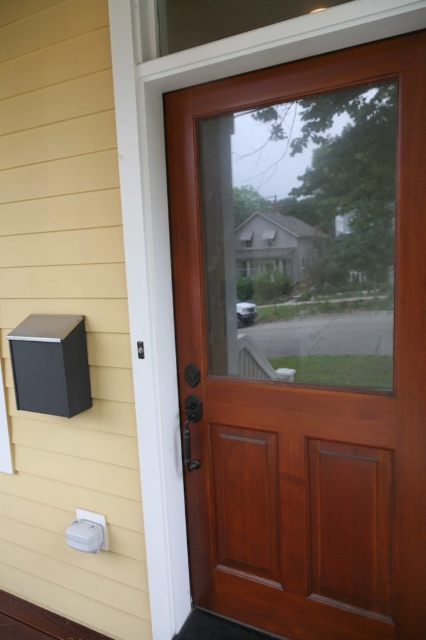
Question: Which object is farther from the camera taking this photo?

Choices:
 (A) mahogany wood screen door at center
 (B) yellow siding at left

Answer: (B)

Question: Which of the following is the closest to the observer?

Choices:
 (A) (9, 570)
 (B) (408, 252)

Answer: (B)

Question: Can you confirm if mahogany wood screen door at center is smaller than yellow siding at left?

Choices:
 (A) yes
 (B) no

Answer: (A)

Question: Observing the image, what is the correct spatial positioning of mahogany wood screen door at center in reference to yellow siding at left?

Choices:
 (A) left
 (B) right

Answer: (B)

Question: Does mahogany wood screen door at center appear on the left side of yellow siding at left?

Choices:
 (A) no
 (B) yes

Answer: (A)

Question: Which point is farther from the camera taking this photo?

Choices:
 (A) (403, 136)
 (B) (14, 573)

Answer: (B)